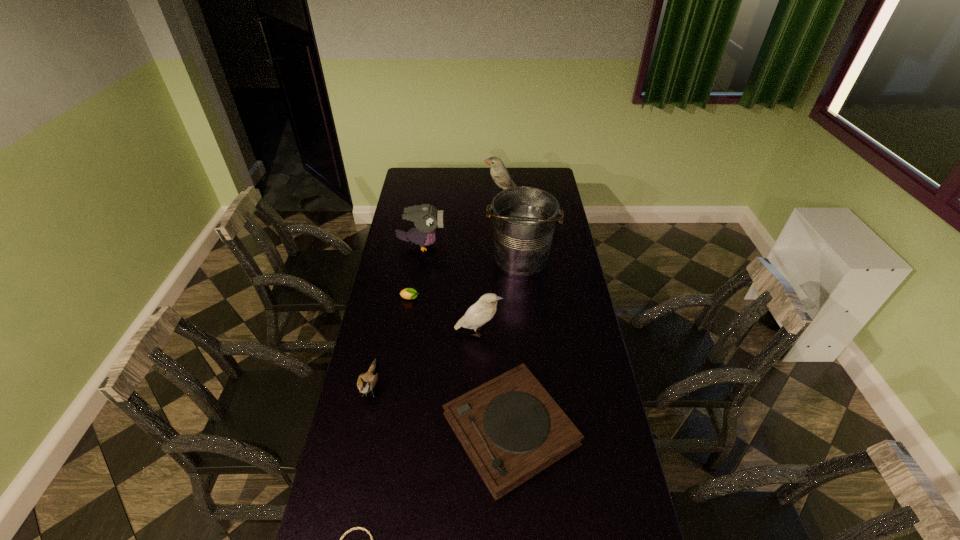
At what (x,y) coordinates should I click in order to perform the action: click on bucket. Please return your answer as a coordinate pair (x, y). The height and width of the screenshot is (540, 960). Looking at the image, I should click on (524, 218).

You are a GUI agent. You are given a task and a screenshot of the screen. Output one action in this format:
    pyautogui.click(x=<x>, y=<y>)
    Task: Click on the farthest object
    This screenshot has width=960, height=540.
    Given the screenshot: What is the action you would take?
    click(499, 173)

At what (x,y) coordinates should I click in order to perform the action: click on the second farthest bird. Please return your answer as a coordinate pair (x, y). Looking at the image, I should click on (426, 218).

Image resolution: width=960 pixels, height=540 pixels. Find the location of `the third farthest bird`. the third farthest bird is located at coordinates (484, 309).

This screenshot has height=540, width=960. Find the location of `the nearest bird`. the nearest bird is located at coordinates (366, 382).

Image resolution: width=960 pixels, height=540 pixels. Find the location of `the fourth shortest object`. the fourth shortest object is located at coordinates (366, 382).

Find the location of `phonograph record`. phonograph record is located at coordinates (511, 428).

Image resolution: width=960 pixels, height=540 pixels. Find the location of `the fifth nearest object`. the fifth nearest object is located at coordinates (409, 293).

Find the location of a particular element. lemon is located at coordinates (409, 293).

In order to click on free space located on the back of the tallest object in this screenshot , I will do point(515,200).